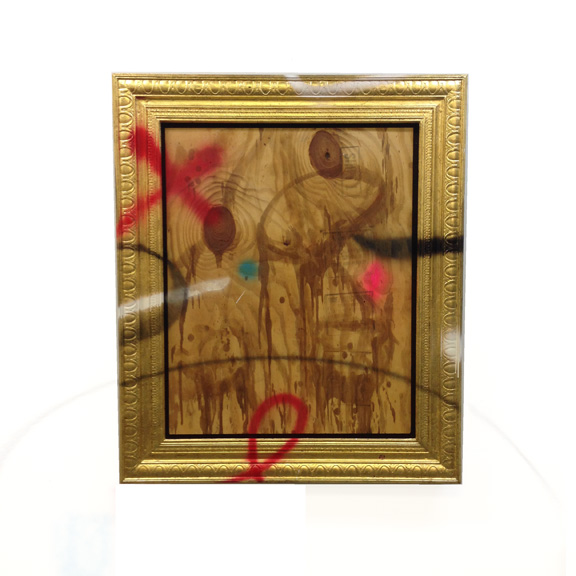
Locate an element on the screen. This screenshot has height=576, width=576. white paint on golden frame is located at coordinates 317,92, 135,302, 449,343.